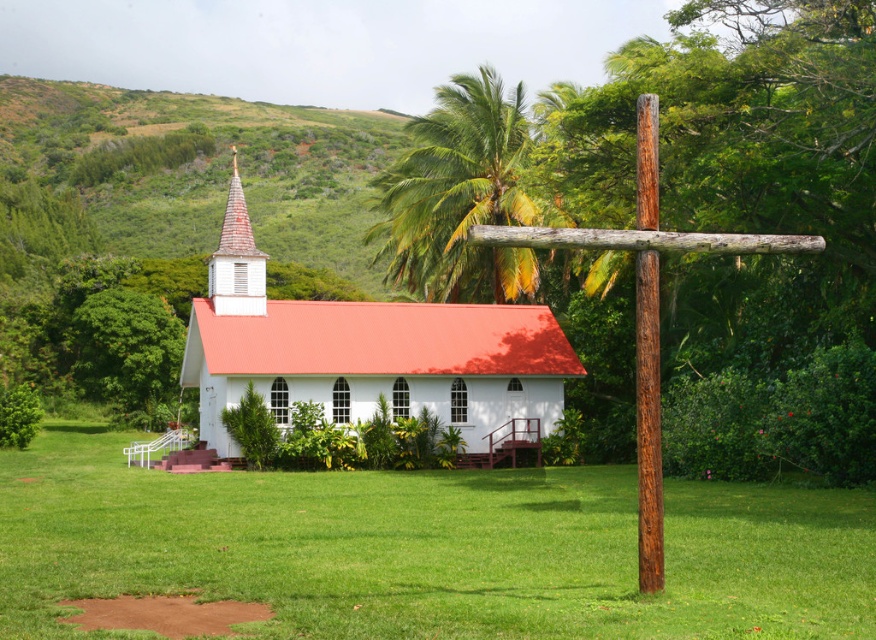
Question: Which point is farther to the camera?

Choices:
 (A) (647, 346)
 (B) (216, 400)
 (C) (214, 282)

Answer: (C)

Question: Where is green leafy palm tree at upper center located in relation to brown wood pole at right in the image?

Choices:
 (A) left
 (B) right

Answer: (A)

Question: Is green leafy palm tree at upper center to the right of wooden shingles spire at upper left from the viewer's perspective?

Choices:
 (A) yes
 (B) no

Answer: (A)

Question: Among these points, which one is nearest to the camera?

Choices:
 (A) (650, 212)
 (B) (401, 416)
 (C) (223, 272)
 (D) (506, 200)

Answer: (A)

Question: Estimate the real-world distances between objects in this image. Which object is farther from the green leafy palm tree at upper center?

Choices:
 (A) green grass at center
 (B) wooden shingles spire at upper left

Answer: (A)

Question: Does green grass at center appear over brown wood pole at right?

Choices:
 (A) no
 (B) yes

Answer: (A)